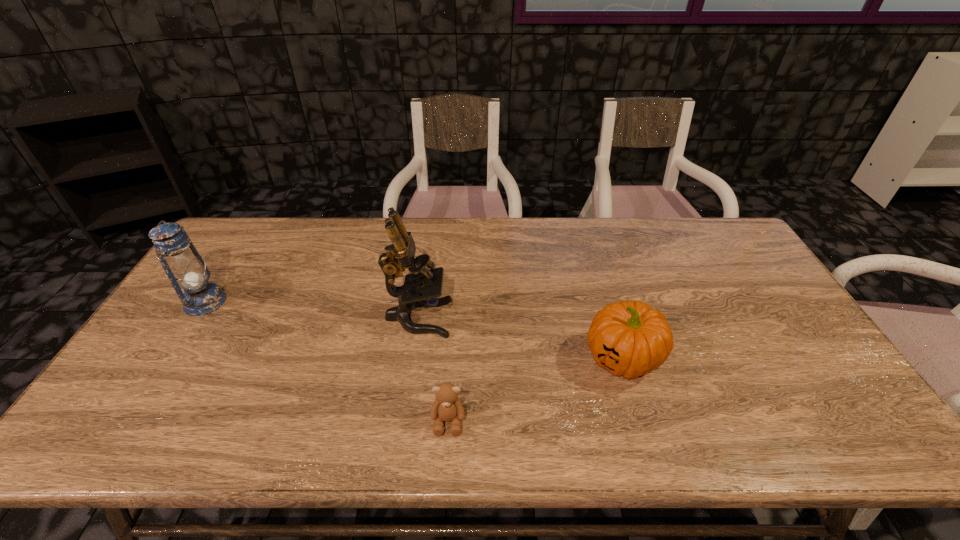
Locate an element on the screen. Image resolution: width=960 pixels, height=540 pixels. free space located 0.150m on the surface of the pumpkin is located at coordinates tap(526, 358).

Locate an element on the screen. Image resolution: width=960 pixels, height=540 pixels. free space located 0.310m on the surface of the pumpkin is located at coordinates (465, 358).

You are a GUI agent. You are given a task and a screenshot of the screen. Output one action in this format:
    pyautogui.click(x=<x>, y=<y>)
    Task: Click on the object located in the near edge section of the desktop
    Image resolution: width=960 pixels, height=540 pixels.
    Given the screenshot: What is the action you would take?
    pyautogui.click(x=447, y=407)

Image resolution: width=960 pixels, height=540 pixels. I want to click on object at the left edge, so click(186, 270).

The height and width of the screenshot is (540, 960). Find the location of `vacant area at the far edge`. vacant area at the far edge is located at coordinates (379, 222).

You are a GUI agent. You are given a task and a screenshot of the screen. Output one action in this format:
    pyautogui.click(x=<x>, y=<y>)
    Task: Click on the free space at the near edge of the desktop
    
    Given the screenshot: What is the action you would take?
    pyautogui.click(x=422, y=419)

In the image, there is a desktop. At what (x,y) coordinates should I click in order to perform the action: click on vacant area at the left edge. Please return your answer as a coordinate pair (x, y). Looking at the image, I should click on (113, 413).

Where is `free space at the right edge`? The height and width of the screenshot is (540, 960). free space at the right edge is located at coordinates [x=775, y=363].

The height and width of the screenshot is (540, 960). What are the coordinates of `vacant area at the far left corner of the desktop` in the screenshot? It's located at (260, 242).

Locate an element on the screen. The width and height of the screenshot is (960, 540). vacant area that lies between the teddy bear and the lantern is located at coordinates (326, 361).